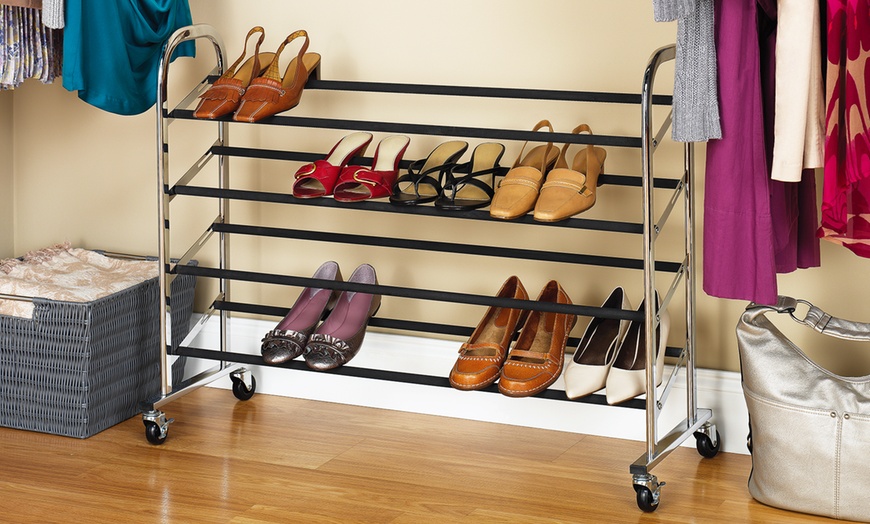
Find the location of a particular element. The image size is (870, 524). shoes on bottom rack is located at coordinates (279, 337), (324, 345), (478, 374), (518, 375), (614, 387), (591, 382).